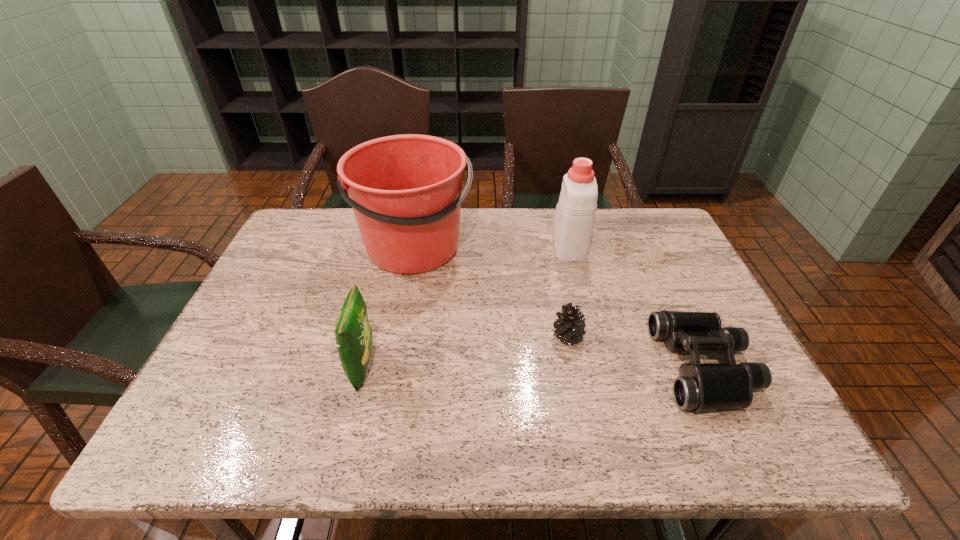
Identify the location of bucket. (406, 192).

Identify the location of detergent. (574, 217).

I want to click on crisp (potato chip), so click(353, 334).

Locate an element on the screen. The image size is (960, 540). pinecone is located at coordinates (570, 324).

The width and height of the screenshot is (960, 540). I want to click on the rightmost object, so click(700, 386).

The width and height of the screenshot is (960, 540). I want to click on vacant space situated on the front of the bucket, so click(x=394, y=367).

The height and width of the screenshot is (540, 960). I want to click on vacant space located on the handle side of the detergent, so 562,215.

Find the location of `vacant space located on the handle side of the detergent`. vacant space located on the handle side of the detergent is located at coordinates (561, 209).

The width and height of the screenshot is (960, 540). I want to click on vacant space located 0.070m on the handle side of the detergent, so click(562, 214).

I want to click on free spot located on the front-facing side of the third shortest object, so click(518, 367).